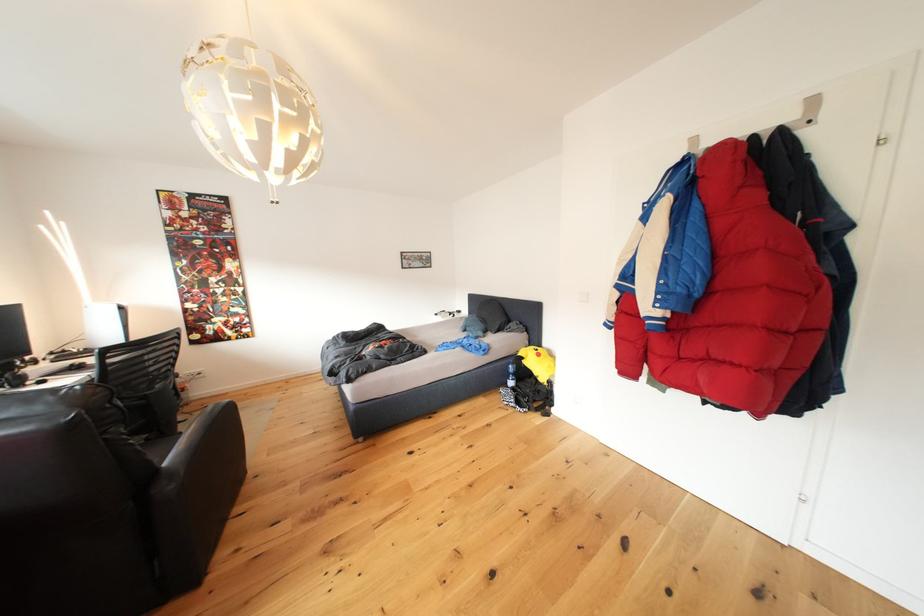
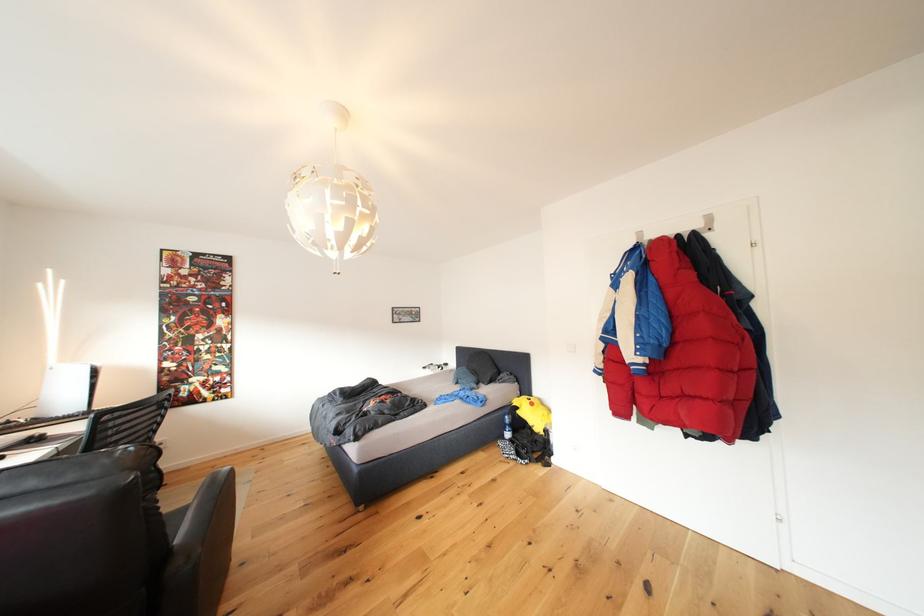
Find the pixel in the second image that matches pixel 235 426 in the first image.

(229, 498)